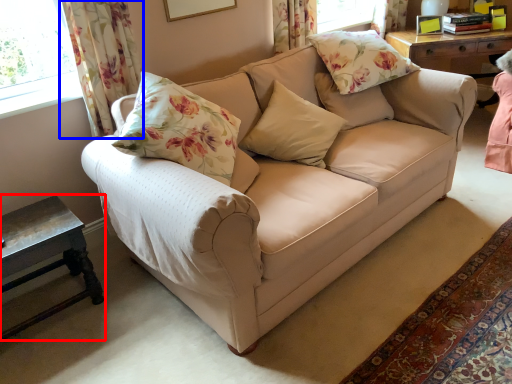
Question: Which object appears farthest to the camera in this image, table (highlighted by a red box) or curtain (highlighted by a blue box)?

Choices:
 (A) table
 (B) curtain

Answer: (B)